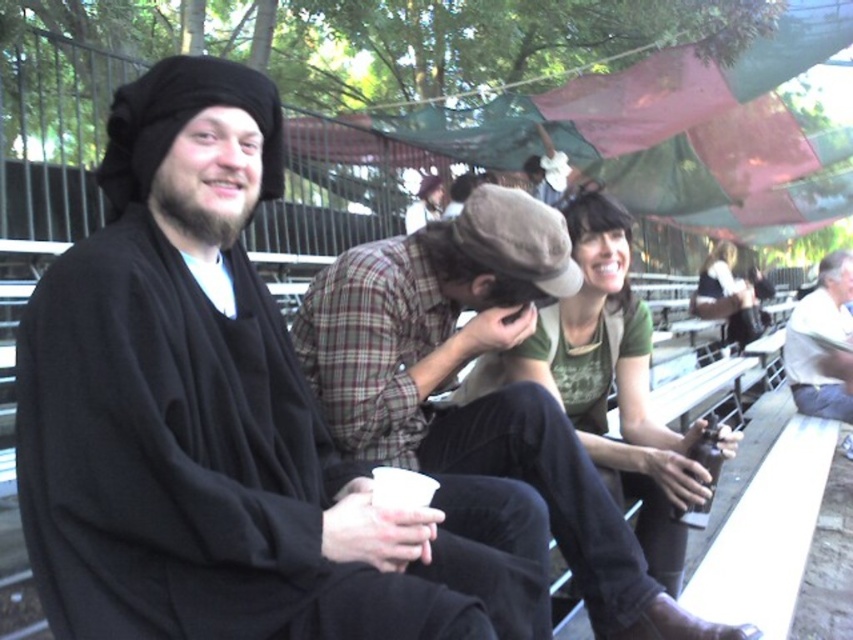
You are at the festival and want to find the plaid shirt at center. Where is it located in the image?

The plaid shirt at center is located at point 0.619 on the horizontal axis and 0.570 on the vertical axis.

You are standing at the origin point of the coordinate system where the image is displayed. The plaid shirt at center is located at point (485, 396). If you want to move towards the plaid shirt at center, which direction should you move in terms of x and y coordinates?

To move towards the plaid shirt at center located at point (485, 396) from the origin, you should move in the positive x and positive y direction since both coordinates are greater than zero.

You are a photographer at this event. You want to take a photo that includes both the black matte robe at left and the plaid shirt at center. The minimum distance between the two subjects for your camera to focus properly is 40 centimeters. Will the current distance allow for a clear photo?

The black matte robe at left and plaid shirt at center are 38.46 centimeters apart, which is less than the required 40 centimeters. Therefore, the camera may struggle to focus properly, resulting in a less clear photo.